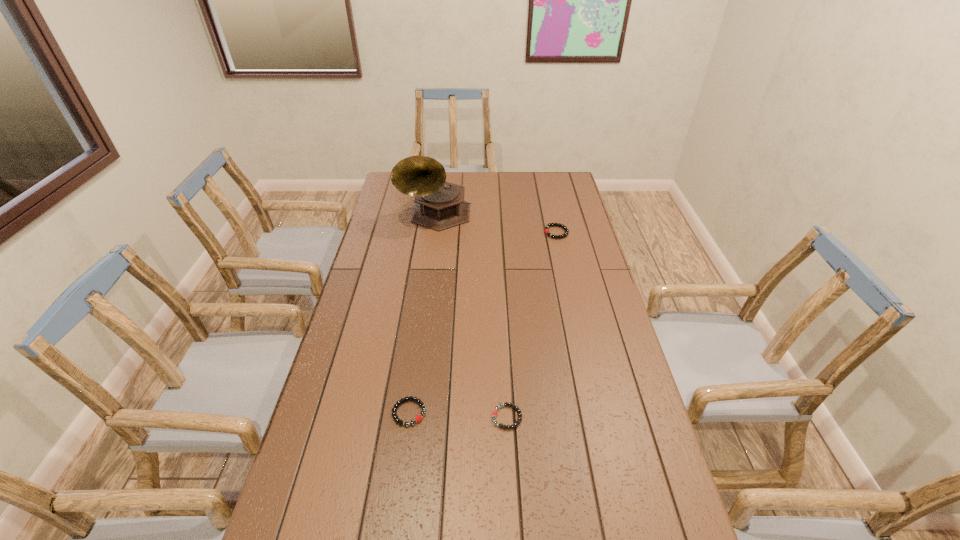
Where is `free space that satisfies the following two spatial constraints: 1. on the back side of the farthest bracelet; 2. on the right side of the leftmost bracelet`? Image resolution: width=960 pixels, height=540 pixels. free space that satisfies the following two spatial constraints: 1. on the back side of the farthest bracelet; 2. on the right side of the leftmost bracelet is located at coordinates (434, 232).

At what (x,y) coordinates should I click in order to perform the action: click on free space in the image that satisfies the following two spatial constraints: 1. on the horn direction of the second bracelet from left to right; 2. on the right side of the phonograph record. Please return your answer as a coordinate pair (x, y). Looking at the image, I should click on (409, 417).

Identify the location of vacant point that satisfies the following two spatial constraints: 1. on the horn direction of the phonograph record; 2. on the right side of the rightmost bracelet. This screenshot has width=960, height=540. (434, 232).

At what (x,y) coordinates should I click in order to perform the action: click on vacant area in the image that satisfies the following two spatial constraints: 1. on the horn direction of the second bracelet from left to right; 2. on the left side of the tallest object. Please return your answer as a coordinate pair (x, y). Image resolution: width=960 pixels, height=540 pixels. Looking at the image, I should click on (409, 417).

I want to click on free spot that satisfies the following two spatial constraints: 1. on the horn direction of the tallest object; 2. on the left side of the second bracelet from right to left, so click(x=409, y=417).

Locate an element on the screen. This screenshot has width=960, height=540. blank space that satisfies the following two spatial constraints: 1. on the back side of the second bracelet from right to left; 2. on the right side of the rightmost bracelet is located at coordinates [497, 232].